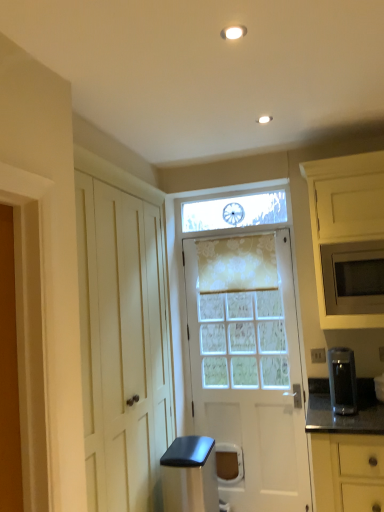
Question: Is white textured door at center taller than floral sheer curtain at center?

Choices:
 (A) yes
 (B) no

Answer: (A)

Question: Considering the relative sizes of white textured door at center and floral sheer curtain at center in the image provided, is white textured door at center smaller than floral sheer curtain at center?

Choices:
 (A) yes
 (B) no

Answer: (B)

Question: Is white textured door at center facing towards floral sheer curtain at center?

Choices:
 (A) no
 (B) yes

Answer: (B)

Question: Can you confirm if white textured door at center is wider than floral sheer curtain at center?

Choices:
 (A) no
 (B) yes

Answer: (B)

Question: Can you confirm if white textured door at center is shorter than floral sheer curtain at center?

Choices:
 (A) yes
 (B) no

Answer: (B)

Question: Considering the relative positions of white textured door at center and floral sheer curtain at center in the image provided, is white textured door at center behind floral sheer curtain at center?

Choices:
 (A) no
 (B) yes

Answer: (A)

Question: Considering the relative sizes of white textured door at center and satin black coffee maker at right, the first appliance when ordered from right to left, in the image provided, is white textured door at center bigger than satin black coffee maker at right, the first appliance when ordered from right to left,?

Choices:
 (A) yes
 (B) no

Answer: (A)

Question: Is white textured door at center positioned behind satin black coffee maker at right, which appears as the second appliance when viewed from the left?

Choices:
 (A) yes
 (B) no

Answer: (A)

Question: From the image's perspective, is white textured door at center located above satin black coffee maker at right, the first appliance when ordered from right to left?

Choices:
 (A) no
 (B) yes

Answer: (B)

Question: Is white textured door at center smaller than satin black coffee maker at right, which appears as the second appliance when viewed from the left?

Choices:
 (A) yes
 (B) no

Answer: (B)

Question: Considering the relative positions of white textured door at center and satin black coffee maker at right, the first appliance when ordered from right to left, in the image provided, is white textured door at center to the right of satin black coffee maker at right, the first appliance when ordered from right to left, from the viewer's perspective?

Choices:
 (A) yes
 (B) no

Answer: (B)

Question: Does white textured door at center have a greater height compared to satin black coffee maker at right, which appears as the second appliance when viewed from the left?

Choices:
 (A) yes
 (B) no

Answer: (A)

Question: Is satin black trash can at lower center, acting as the 2th appliance starting from the right, turned away from floral sheer curtain at center?

Choices:
 (A) no
 (B) yes

Answer: (A)